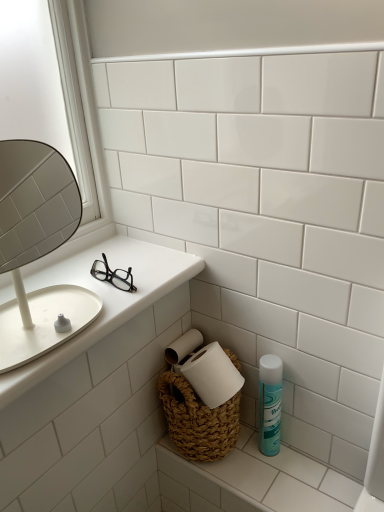
Image resolution: width=384 pixels, height=512 pixels. I want to click on free point to the left of teal matte mouthwash at lower right, so click(238, 456).